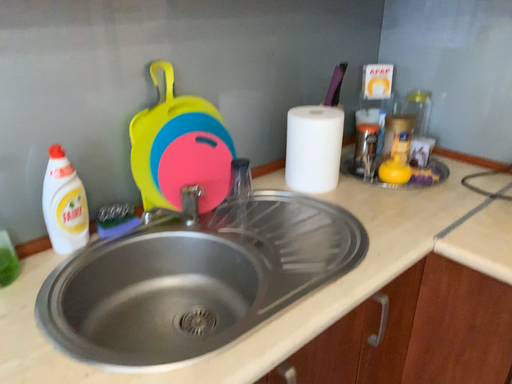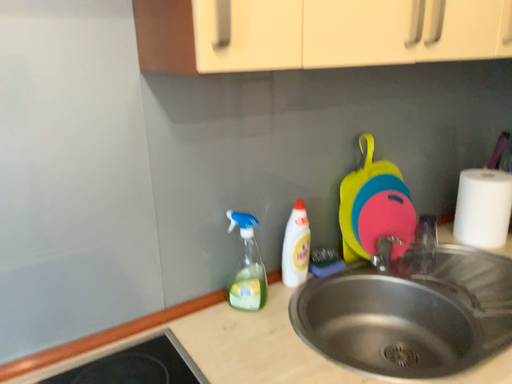
Question: Which way did the camera rotate in the video?

Choices:
 (A) rotated downward
 (B) rotated upward

Answer: (B)